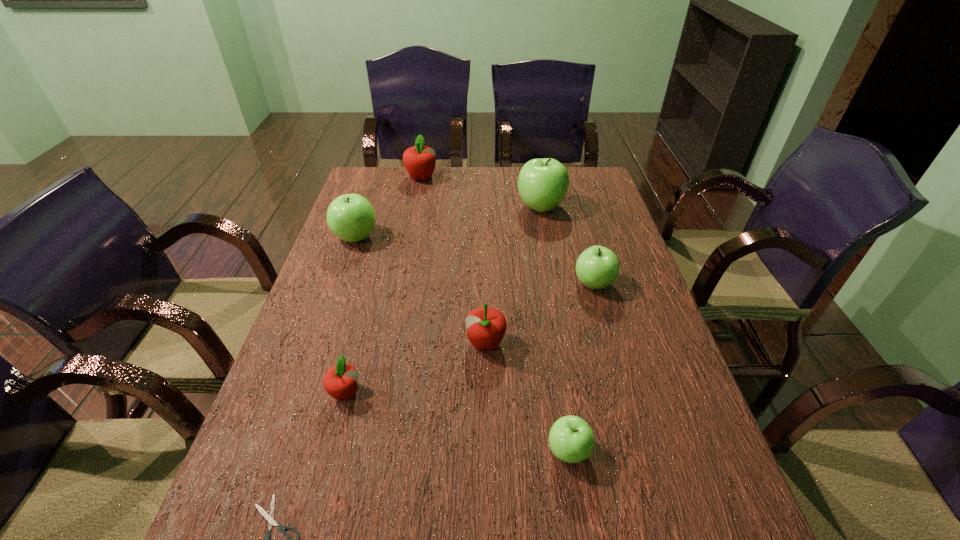
At what (x,y) coordinates should I click in order to perform the action: click on the sixth farthest apple. Please return your answer as a coordinate pair (x, y). The width and height of the screenshot is (960, 540). Looking at the image, I should click on (340, 381).

Locate an element on the screen. This screenshot has height=540, width=960. the smallest red apple is located at coordinates (340, 381).

At what (x,y) coordinates should I click in order to perform the action: click on the nearest apple. Please return your answer as a coordinate pair (x, y). Looking at the image, I should click on (571, 439).

Locate an element on the screen. This screenshot has height=540, width=960. the seventh farthest object is located at coordinates (571, 439).

Identify the location of blank space located on the left of the biggest green apple. The image size is (960, 540). (417, 207).

Find the location of a particular element. The width and height of the screenshot is (960, 540). free location located on the front of the biggest red apple is located at coordinates (415, 212).

This screenshot has height=540, width=960. I want to click on blank area located 0.150m on the right of the sixth nearest object, so tap(427, 237).

Image resolution: width=960 pixels, height=540 pixels. I want to click on free point located on the back of the fourth farthest apple, so click(x=579, y=230).

This screenshot has height=540, width=960. What are the coordinates of `free space located on the left of the fourth nearest object` in the screenshot? It's located at (358, 343).

Identify the location of free location located 0.320m on the back of the nearest red apple. (374, 282).